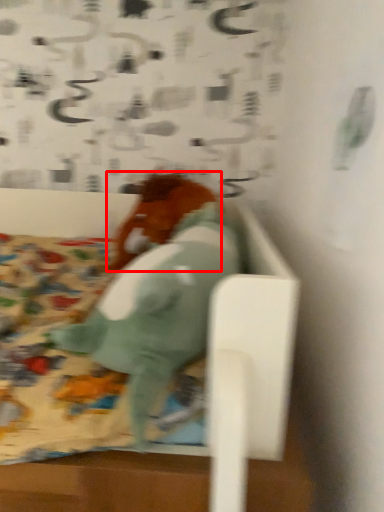
Question: From the image's perspective, where is animal (annotated by the red box) located relative to animal?

Choices:
 (A) below
 (B) above

Answer: (B)